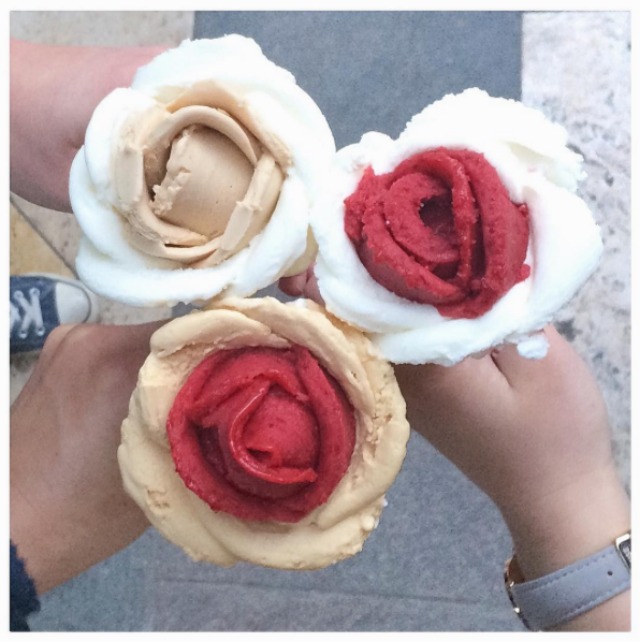
At what (x,y) coordinates should I click in order to perform the action: click on floor. Please return your answer as a coordinate pair (x, y). Looking at the image, I should click on (352, 76), (34, 256), (420, 593).